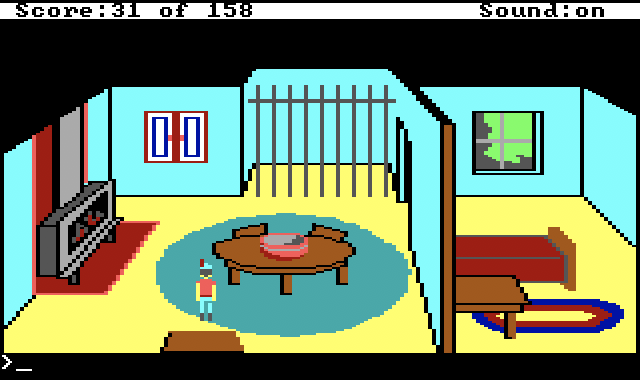
Where is `rug next to bed`? This screenshot has width=640, height=380. rug next to bed is located at coordinates pyautogui.click(x=573, y=313).